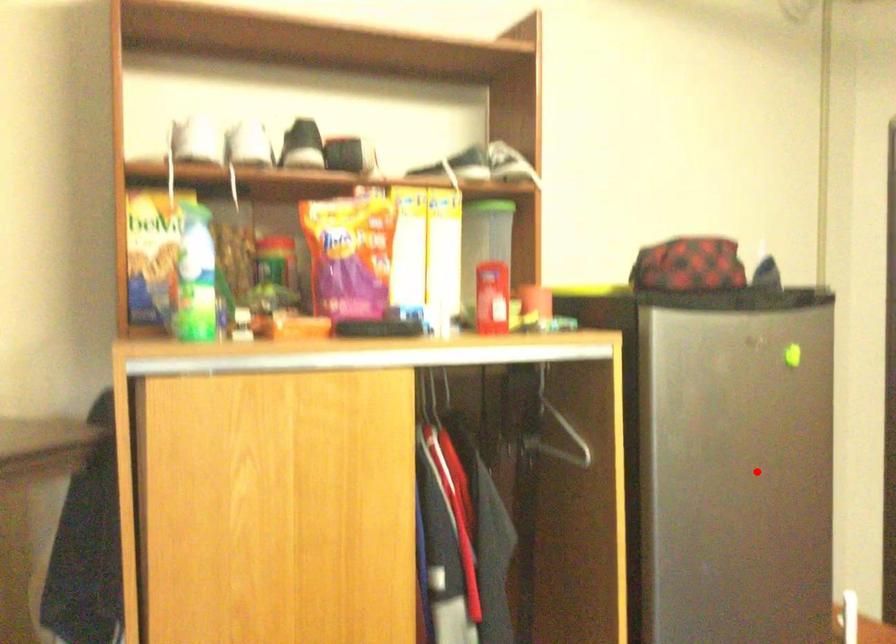
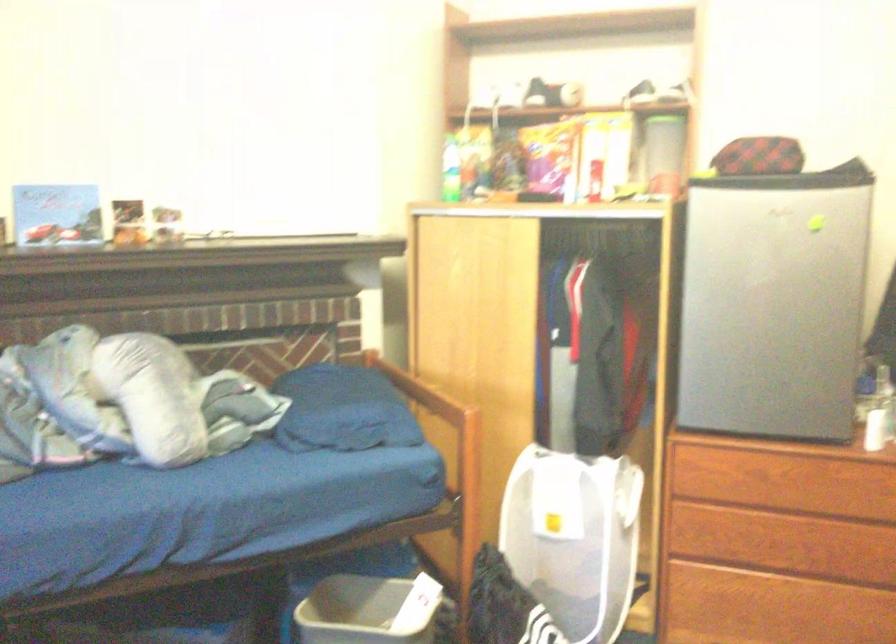
The point at the highlighted location is marked in the first image. Where is the corresponding point in the second image?

(771, 303)